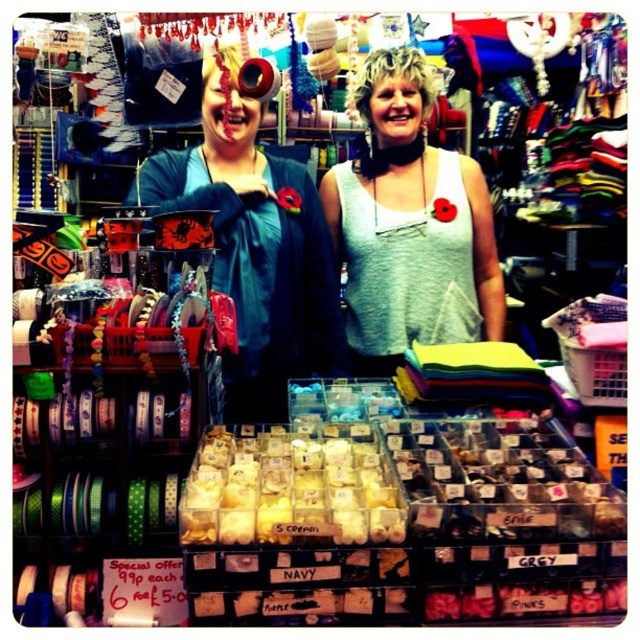
Can you confirm if blue fabric at center is bigger than gray cotton tank top at center?

Yes, blue fabric at center is bigger than gray cotton tank top at center.

Who is positioned more to the right, blue fabric at center or gray cotton tank top at center?

Positioned to the right is gray cotton tank top at center.

At what (x,y) coordinates should I click in order to perform the action: click on blue fabric at center. Please return your answer as a coordinate pair (x, y). Looking at the image, I should click on (406, 228).

Locate an element on the screen. This screenshot has width=640, height=640. blue fabric at center is located at coordinates (406, 228).